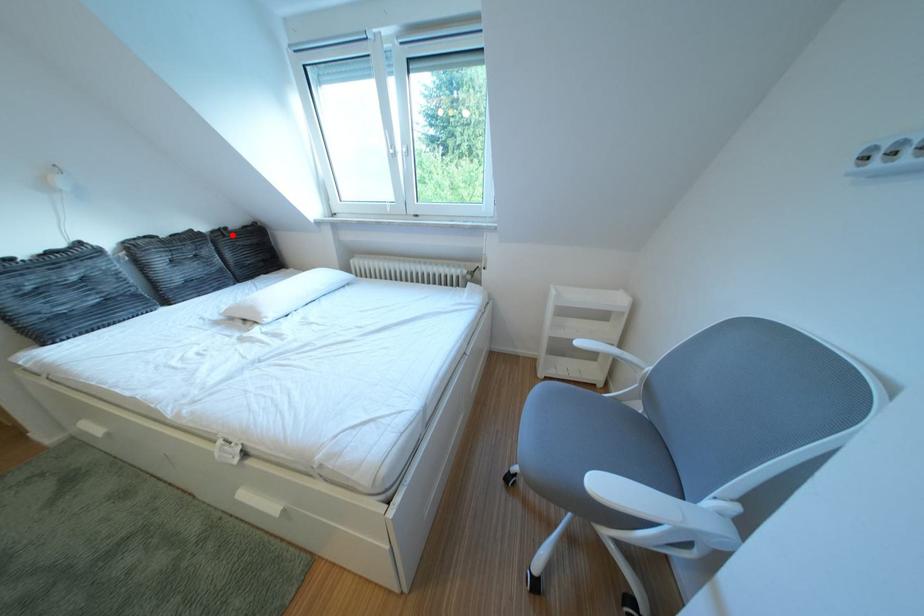
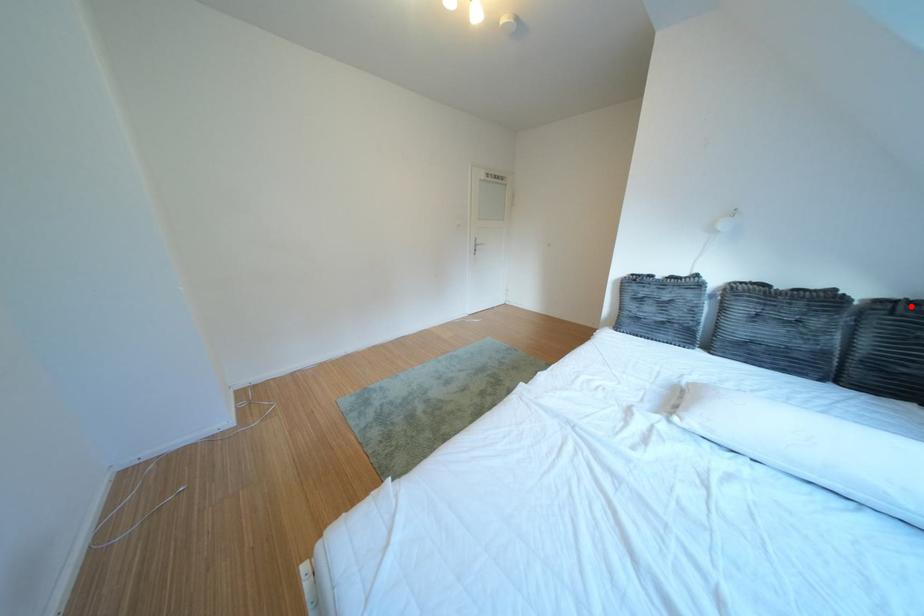
I am providing you with two images of the same scene from different viewpoints. A red point is marked on the first image and another point is marked on the second image. Is the marked point in image1 the same physical position as the marked point in image2?

Yes